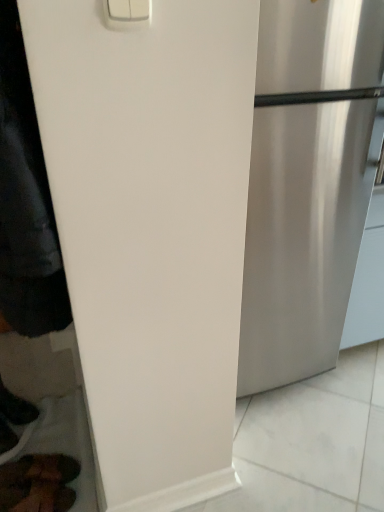
Question: Considering the relative sizes of black leather shoe at lower left and brown leather shoes at lower left in the image provided, is black leather shoe at lower left bigger than brown leather shoes at lower left?

Choices:
 (A) yes
 (B) no

Answer: (A)

Question: Is brown leather shoes at lower left surrounded by black leather shoe at lower left?

Choices:
 (A) no
 (B) yes

Answer: (A)

Question: From the image's perspective, is black leather shoe at lower left located above brown leather shoes at lower left?

Choices:
 (A) yes
 (B) no

Answer: (A)

Question: Can you see black leather shoe at lower left touching brown leather shoes at lower left?

Choices:
 (A) no
 (B) yes

Answer: (A)

Question: Does black leather shoe at lower left have a smaller size compared to brown leather shoes at lower left?

Choices:
 (A) no
 (B) yes

Answer: (A)

Question: Considering the relative positions of black leather shoe at lower left and brown leather shoes at lower left in the image provided, is black leather shoe at lower left in front of brown leather shoes at lower left?

Choices:
 (A) no
 (B) yes

Answer: (A)

Question: From the image's perspective, is satin silver refrigerator at right below black leather shoe at lower left?

Choices:
 (A) yes
 (B) no

Answer: (B)

Question: Are satin silver refrigerator at right and black leather shoe at lower left making contact?

Choices:
 (A) no
 (B) yes

Answer: (A)

Question: Is satin silver refrigerator at right turned away from black leather shoe at lower left?

Choices:
 (A) no
 (B) yes

Answer: (A)

Question: Does satin silver refrigerator at right have a greater width compared to black leather shoe at lower left?

Choices:
 (A) no
 (B) yes

Answer: (B)

Question: Is satin silver refrigerator at right aimed at black leather shoe at lower left?

Choices:
 (A) yes
 (B) no

Answer: (B)

Question: Does satin silver refrigerator at right appear on the right side of black leather shoe at lower left?

Choices:
 (A) no
 (B) yes

Answer: (B)

Question: Could satin silver refrigerator at right be considered to be inside black matte jacket at left?

Choices:
 (A) no
 (B) yes

Answer: (A)